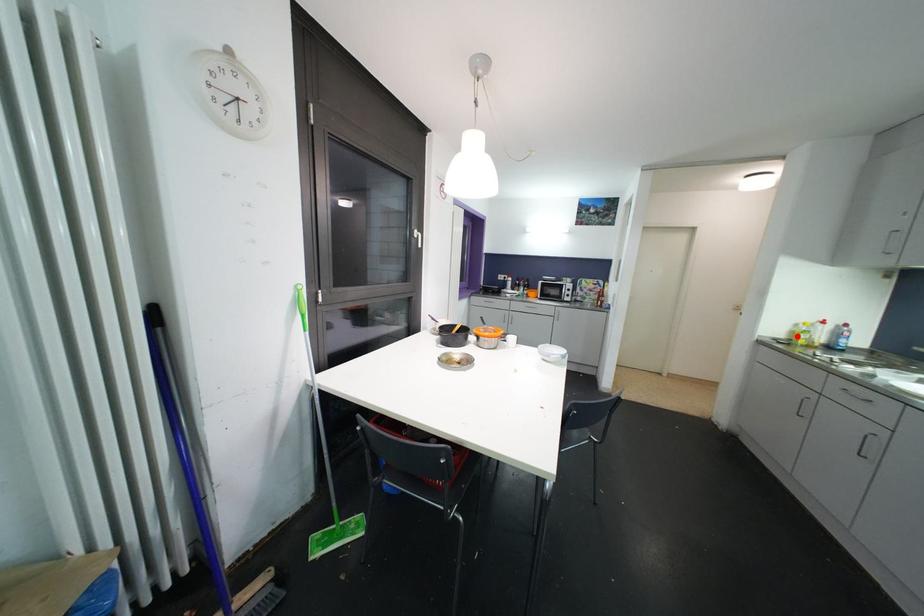
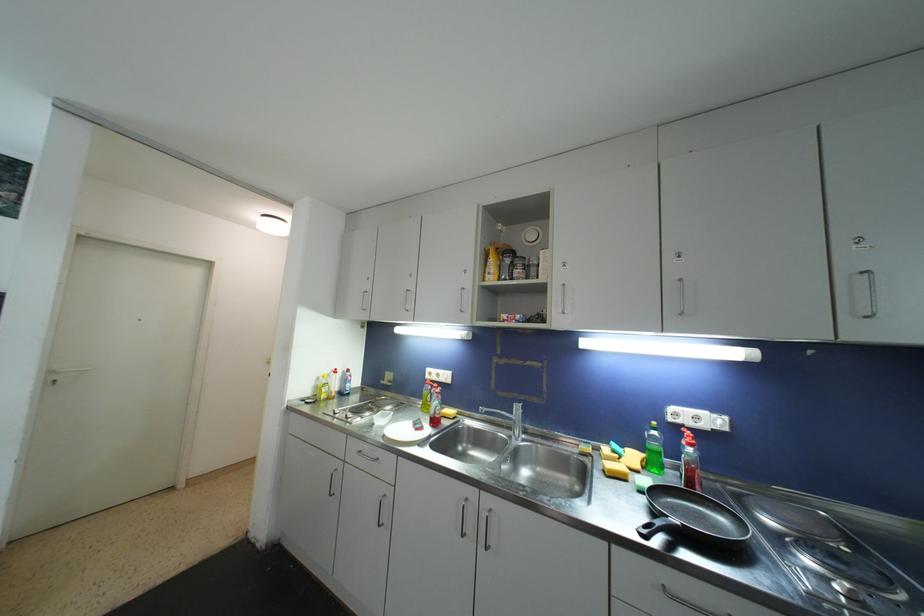
Locate, in the second image, the point that corresponds to the highlighted location in the first image.

(321, 391)